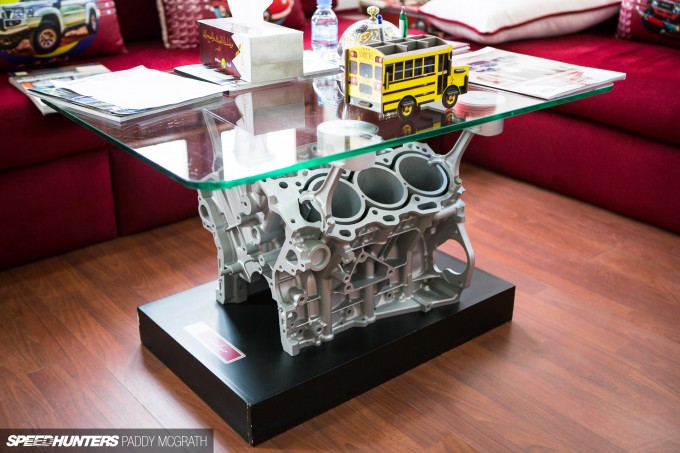
At what (x,y) coordinates should I click in order to perform the action: click on stand. Please return your answer as a coordinate pair (x, y). Looking at the image, I should click on (403, 357).